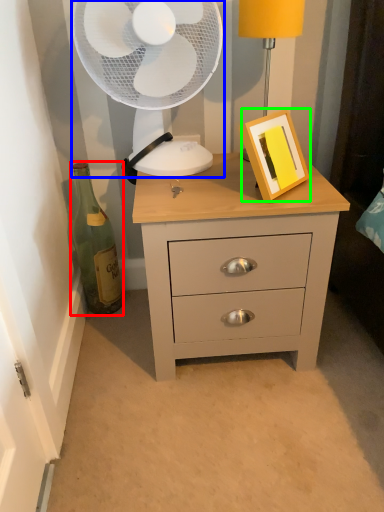
Question: Which object is the farthest from bottle (highlighted by a red box)? Choose among these: mechanical fan (highlighted by a blue box) or picture frame (highlighted by a green box).

Choices:
 (A) mechanical fan
 (B) picture frame

Answer: (B)